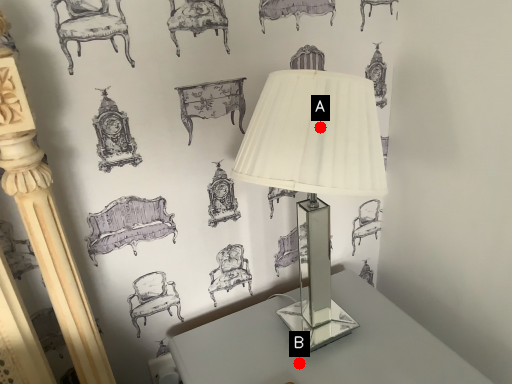
Question: Two points are circled on the image, labeled by A and B beside each circle. Among these points, which one is nearest to the camera?

Choices:
 (A) A is closer
 (B) B is closer

Answer: (A)